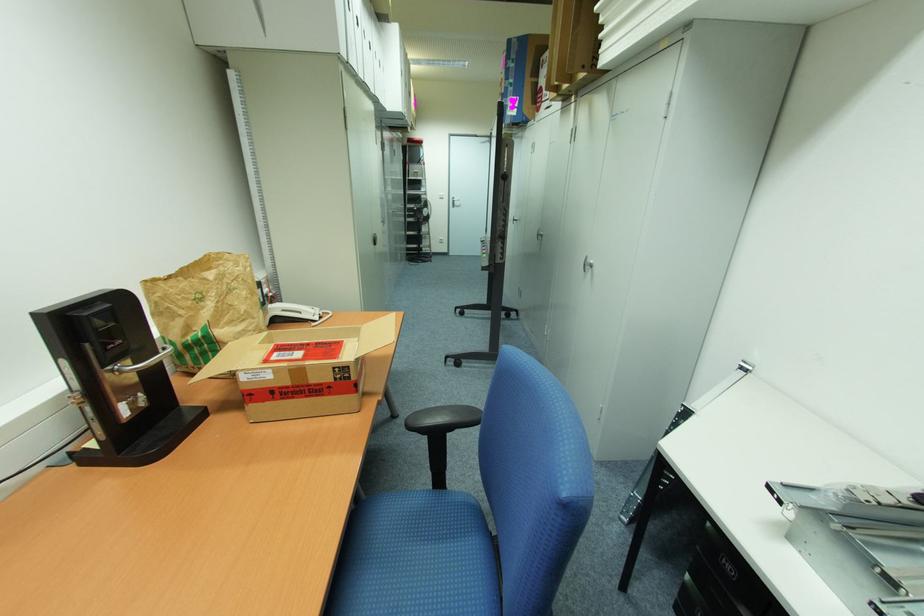
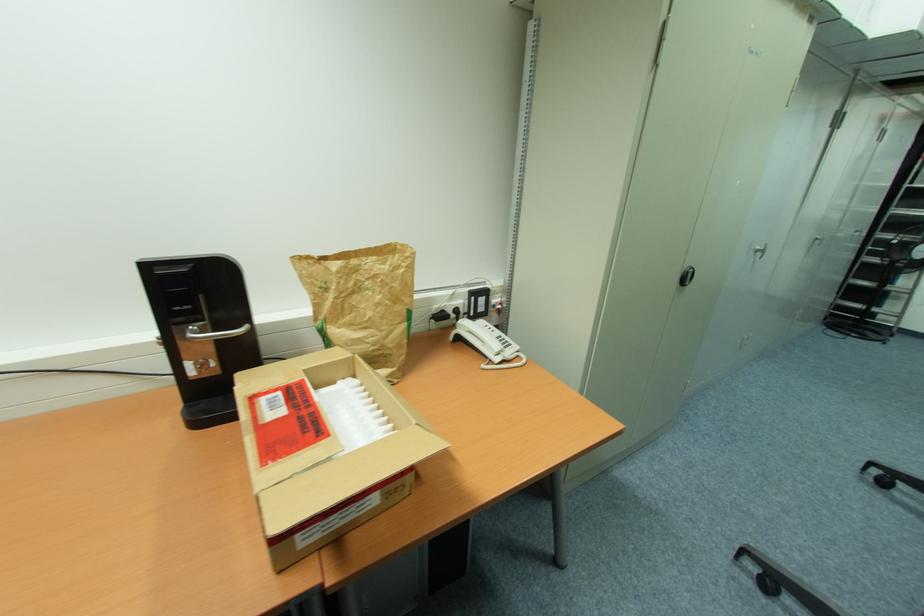
Question: The first image is from the beginning of the video and the second image is from the end. How did the camera likely rotate when shooting the video?

Choices:
 (A) Left
 (B) Right
 (C) Up
 (D) Down

Answer: (A)